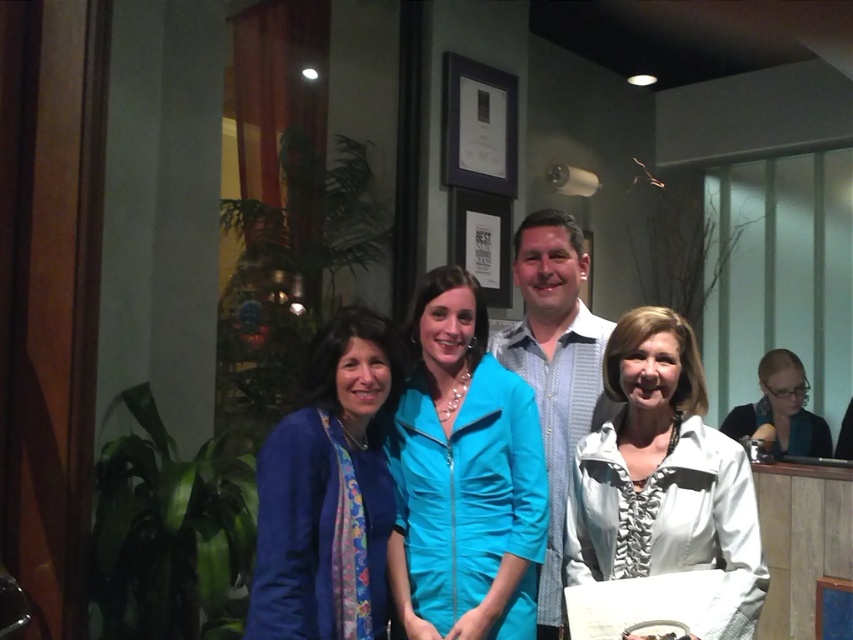
Is matte blue jacket at left taller than light blue shirt at center?

Incorrect, matte blue jacket at left's height is not larger of light blue shirt at center's.

Who is positioned more to the right, matte blue jacket at left or light blue shirt at center?

light blue shirt at center

Does point (351, 486) lie in front of point (564, 362)?

Yes.

Where is `matte blue jacket at left`? This screenshot has width=853, height=640. matte blue jacket at left is located at coordinates (328, 492).

Can you confirm if turquoise fabric jacket at center is wider than matte blue jacket at left?

Yes.

Is turquoise fabric jacket at center behind matte blue jacket at left?

Yes, it is behind matte blue jacket at left.

Does point (439, 593) lie behind point (338, 525)?

Yes, it is.

You are a GUI agent. You are given a task and a screenshot of the screen. Output one action in this format:
    pyautogui.click(x=<x>, y=<y>)
    Task: Click on the turquoise fabric jacket at center
    
    Given the screenshot: What is the action you would take?
    pyautogui.click(x=463, y=476)

Which is more to the right, matte blue jacket at left or matte black jacket at lower right?

From the viewer's perspective, matte black jacket at lower right appears more on the right side.

Can you confirm if matte blue jacket at left is taller than matte black jacket at lower right?

Correct, matte blue jacket at left is much taller as matte black jacket at lower right.

In the scene shown: Measure the distance between matte blue jacket at left and camera.

matte blue jacket at left and camera are 1.60 meters apart.

This screenshot has width=853, height=640. What are the coordinates of `matte blue jacket at left` in the screenshot? It's located at (328, 492).